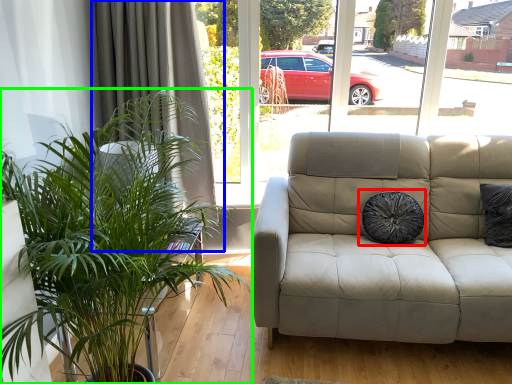
Question: Estimate the real-world distances between objects in this image. Which object is closer to pillow (highlighted by a red box), curtain (highlighted by a blue box) or houseplant (highlighted by a green box)?

Choices:
 (A) curtain
 (B) houseplant

Answer: (A)